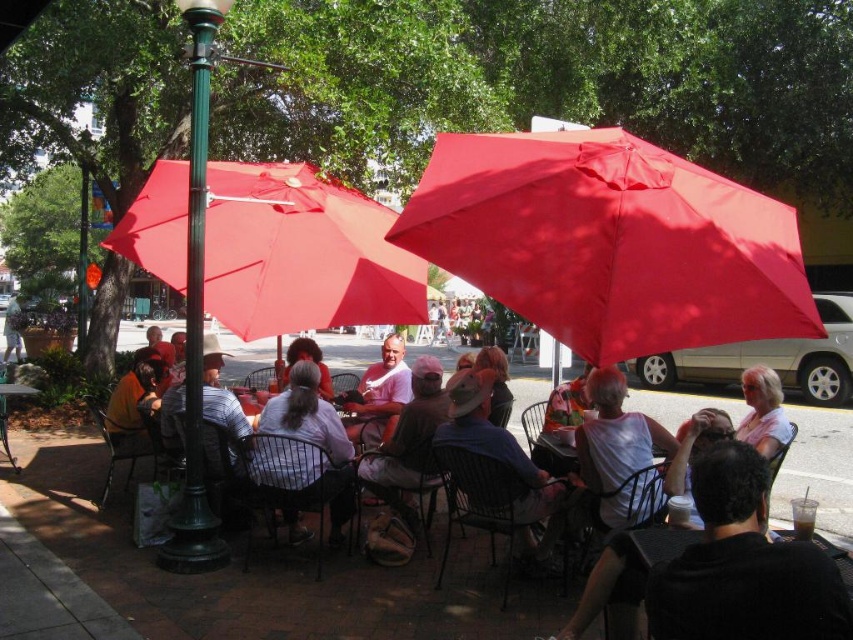
Who is positioned more to the right, matte red umbrella at center or matte white shirt at center?

From the viewer's perspective, matte white shirt at center appears more on the right side.

Describe the element at coordinates (300, 253) in the screenshot. I see `matte red umbrella at center` at that location.

In order to click on matte red umbrella at center in this screenshot , I will do `click(300, 253)`.

Can you confirm if matte red umbrella at center is smaller than brown leather jacket at lower left?

No.

In the scene shown: Between matte red umbrella at center and brown leather jacket at lower left, which one has less height?

With less height is brown leather jacket at lower left.

This screenshot has height=640, width=853. I want to click on matte red umbrella at center, so click(300, 253).

Locate an element on the screen. The image size is (853, 640). matte red umbrella at center is located at coordinates (300, 253).

Can you confirm if black fabric shirt at lower right is positioned above white matte shirt at center?

Indeed, black fabric shirt at lower right is positioned over white matte shirt at center.

Is black fabric shirt at lower right to the left of white matte shirt at center from the viewer's perspective?

No, black fabric shirt at lower right is not to the left of white matte shirt at center.

Is point (845, 634) positioned in front of point (331, 460)?

Yes, point (845, 634) is in front of point (331, 460).

The image size is (853, 640). I want to click on black fabric shirt at lower right, so click(743, 564).